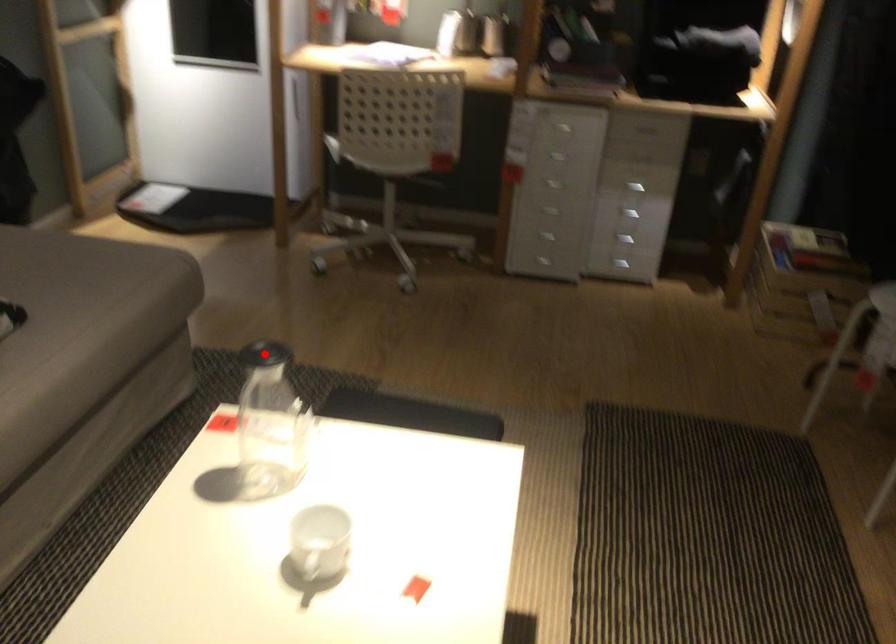
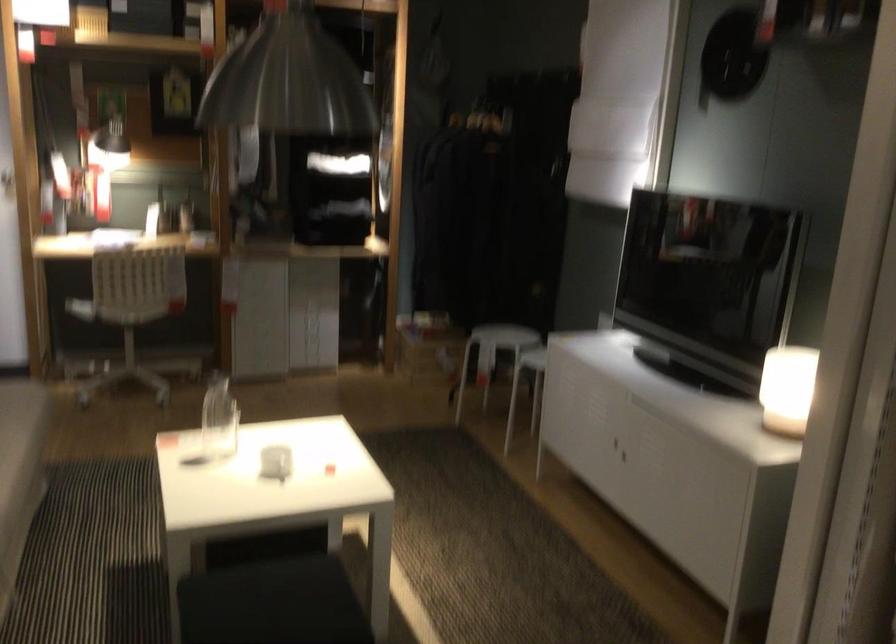
Question: I am providing you with two images of the same scene from different viewpoints. A red point is marked on the first image. Can you still see the location of the red point in image 2?

Choices:
 (A) Yes
 (B) No

Answer: (A)